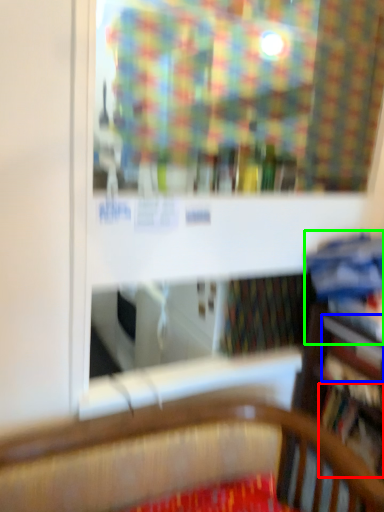
Question: Based on their relative distances, which object is nearer to book (highlighted by a red box)? Choose from book (highlighted by a blue box) and book (highlighted by a green box).

Choices:
 (A) book
 (B) book

Answer: (A)